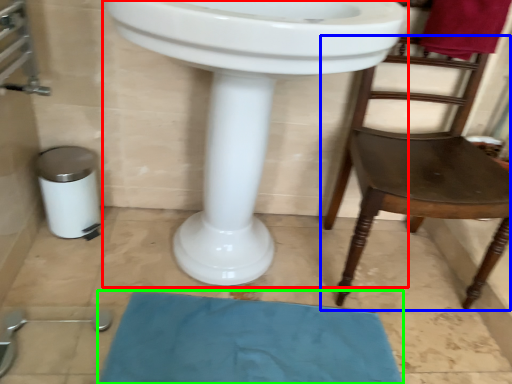
Question: Considering the real-world distances, which object is farthest from sink (highlighted by a red box)? chair (highlighted by a blue box) or bath mat (highlighted by a green box)?

Choices:
 (A) chair
 (B) bath mat

Answer: (A)